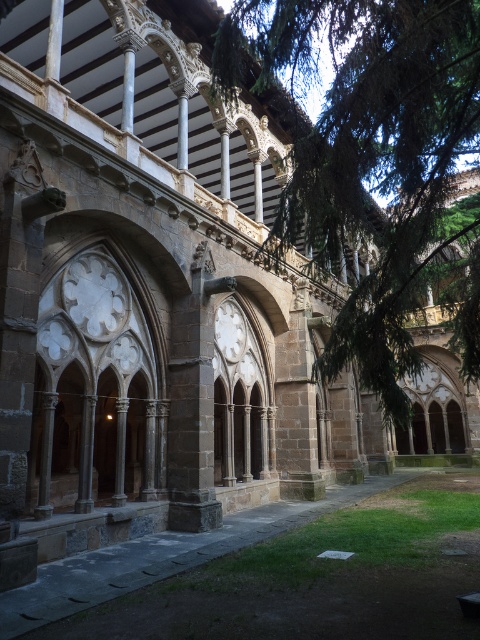
Question: Can you confirm if green leafy tree at center is thinner than brown stone walkway at lower center?

Choices:
 (A) no
 (B) yes

Answer: (A)

Question: Which of the following is the closest to the observer?

Choices:
 (A) brown stone walkway at lower center
 (B) green leafy tree at center

Answer: (A)

Question: Does green leafy tree at center appear over brown stone walkway at lower center?

Choices:
 (A) no
 (B) yes

Answer: (B)

Question: Can you confirm if green leafy tree at center is positioned to the left of brown stone walkway at lower center?

Choices:
 (A) no
 (B) yes

Answer: (A)

Question: Among these points, which one is farthest from the camera?

Choices:
 (A) (312, 588)
 (B) (299, 49)

Answer: (B)

Question: Among these objects, which one is nearest to the camera?

Choices:
 (A) brown stone walkway at lower center
 (B) green leafy tree at center

Answer: (A)